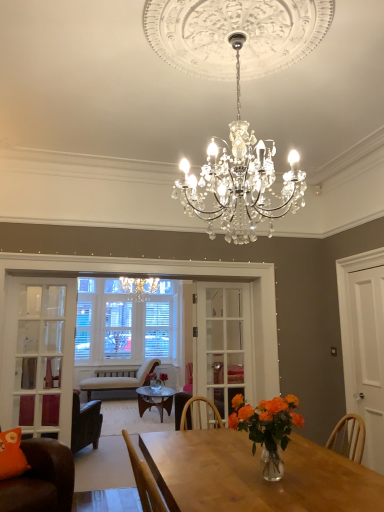
Question: Looking at the image, does clear glass door at center, placed as the 1th glass door when sorted from back to front, seem bigger or smaller compared to brown leather chair at lower left, which is counted as the second chair, starting from the bottom?

Choices:
 (A) big
 (B) small

Answer: (B)

Question: Which is correct: clear glass door at center, which is the 1th glass door in right-to-left order, is inside brown leather chair at lower left, the first chair when ordered from top to bottom, or outside of it?

Choices:
 (A) outside
 (B) inside

Answer: (A)

Question: Which object is the closest to the clear glass door at center, acting as the 2th glass door starting from the front?

Choices:
 (A) brown leather chair at lower left, the first chair when ordered from top to bottom
 (B) light beige fabric chair at center, the second chair in the top-to-bottom sequence
 (C) orange fabric pillow at lower left
 (D) white glass door at left, which is counted as the first glass door, starting from the front
 (E) white matte door at right

Answer: (E)

Question: Which of these objects is positioned closest to the brown leather chair at lower left, which is counted as the second chair, starting from the bottom?

Choices:
 (A) clear glass door at center, acting as the 2th glass door starting from the front
 (B) orange matte vase at center
 (C) white matte door at right
 (D) orange fabric pillow at lower left
 (E) white glass door at left, arranged as the 1th glass door when viewed from the left

Answer: (D)